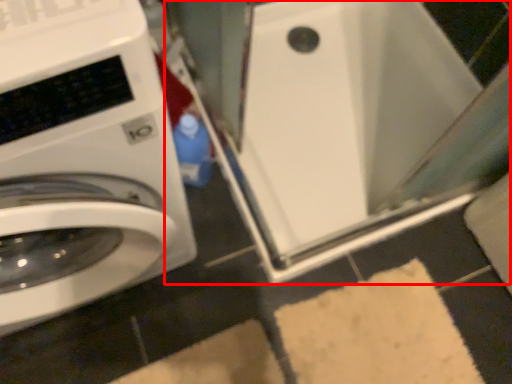
Question: In this image, where is water heater (annotated by the red box) located relative to washing machine?

Choices:
 (A) right
 (B) left

Answer: (A)